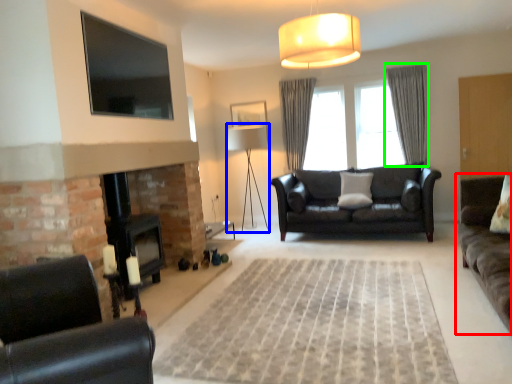
Question: Which is nearer to the studio couch (highlighted by a red box)? lamp (highlighted by a blue box) or curtain (highlighted by a green box).

Choices:
 (A) lamp
 (B) curtain

Answer: (B)